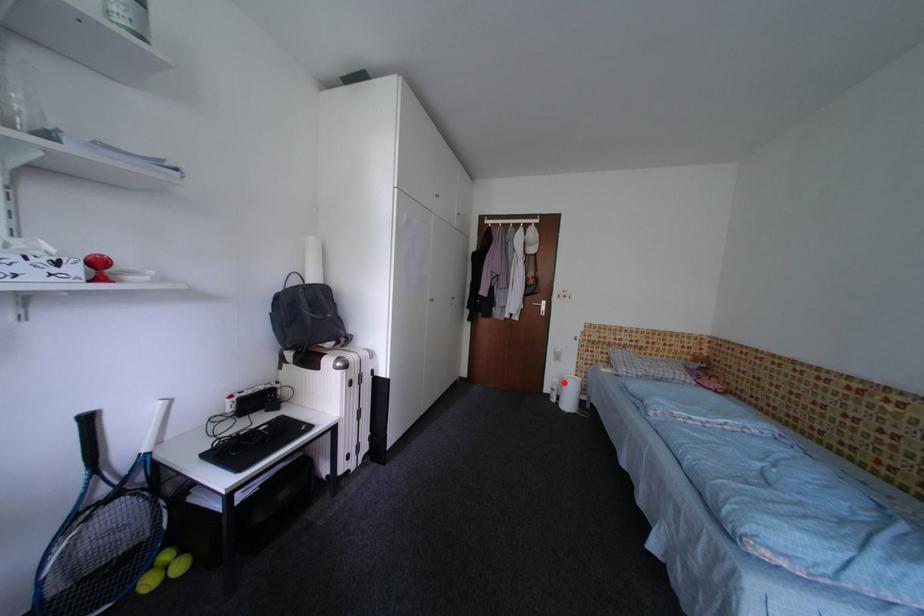
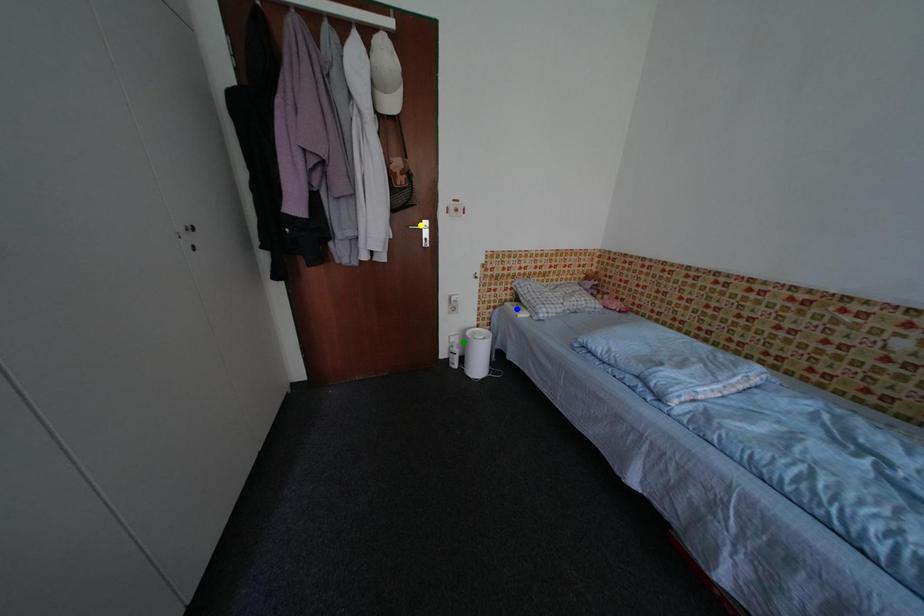
Question: I am providing you with two images of the same scene from different viewpoints. A red point is marked on the first image. You are given multiple points on the second image. Which spot in image 2 lines up with the point in image 1?

Choices:
 (A) green point
 (B) yellow point
 (C) blue point

Answer: (A)